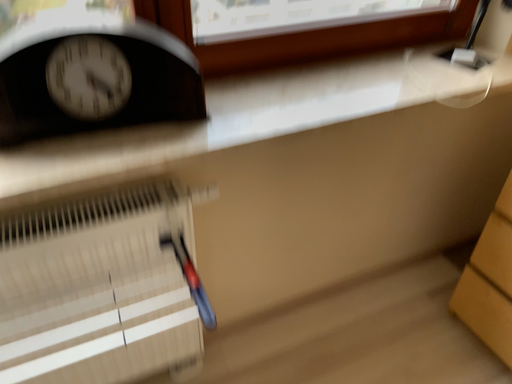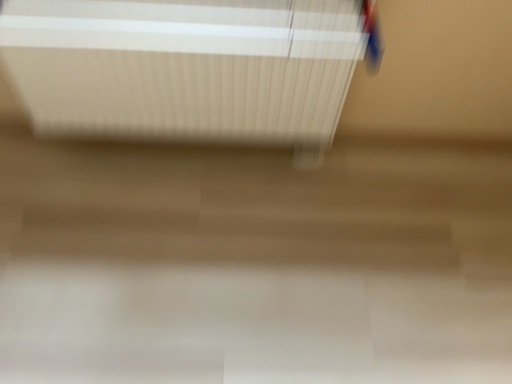
Question: How did the camera likely rotate when shooting the video?

Choices:
 (A) rotated left
 (B) rotated right

Answer: (A)